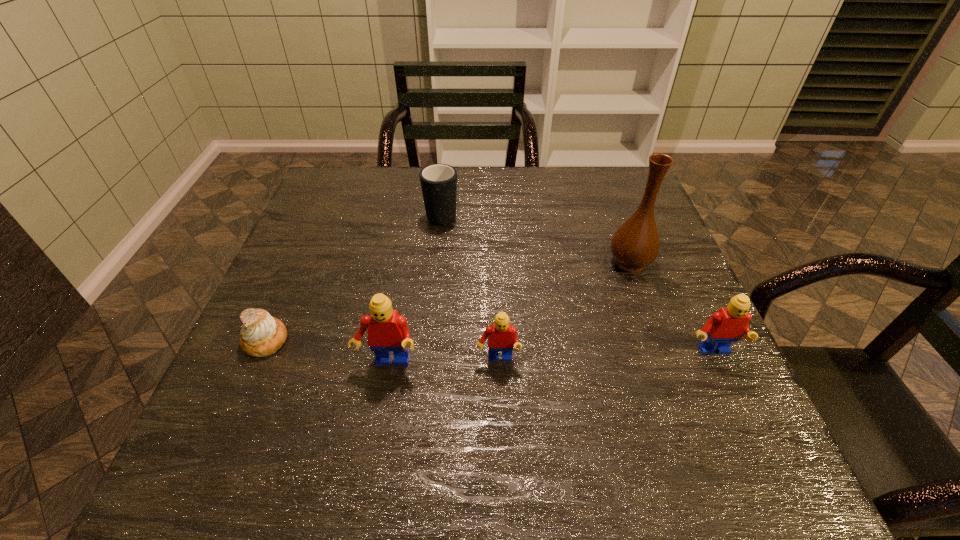
You are a GUI agent. You are given a task and a screenshot of the screen. Output one action in this format:
    pyautogui.click(x=<x>, y=<y>)
    Task: Click on the free space at the far edge of the desktop
    The width and height of the screenshot is (960, 540).
    Given the screenshot: What is the action you would take?
    pyautogui.click(x=566, y=212)

Locate an element on the screen. The width and height of the screenshot is (960, 540). blank space at the near edge is located at coordinates (653, 401).

Locate an element on the screen. This screenshot has height=540, width=960. vacant point at the left edge is located at coordinates (304, 216).

Identify the location of vacant area at the right edge of the desktop. The image size is (960, 540). (678, 306).

Locate an element on the screen. The width and height of the screenshot is (960, 540). vacant space at the near left corner of the desktop is located at coordinates (293, 392).

In the image, there is a desktop. Find the location of `vacant space at the far right corner`. vacant space at the far right corner is located at coordinates (624, 191).

Where is `free space between the farthest object and the rightmost Lego`? free space between the farthest object and the rightmost Lego is located at coordinates (577, 283).

Find the location of `free point between the tallest object and the third object from right to left`. free point between the tallest object and the third object from right to left is located at coordinates (564, 311).

Where is `free space between the pastry and the leftmost Lego`? The height and width of the screenshot is (540, 960). free space between the pastry and the leftmost Lego is located at coordinates (326, 352).

Locate an element on the screen. empty space between the tallest object and the rightmost Lego is located at coordinates (671, 307).